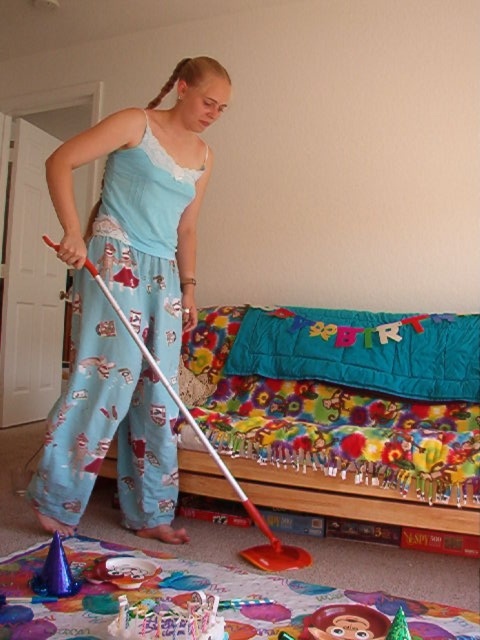
Question: Can you confirm if light blue satin pajama set at center is thinner than floral fabric bed at center?

Choices:
 (A) yes
 (B) no

Answer: (A)

Question: Which of the following is the closest to the observer?

Choices:
 (A) light blue satin pajama set at center
 (B) floral fabric bed at center

Answer: (A)

Question: Is light blue satin pajama set at center to the left of floral fabric bed at center from the viewer's perspective?

Choices:
 (A) yes
 (B) no

Answer: (A)

Question: Can you confirm if light blue satin pajama set at center is positioned to the right of floral fabric bed at center?

Choices:
 (A) no
 (B) yes

Answer: (A)